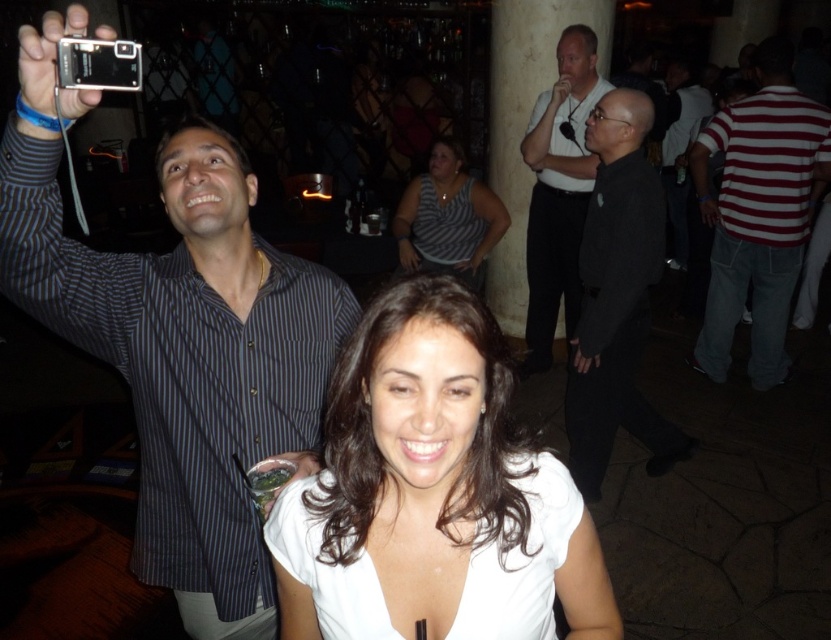
Is red striped shirt at right further to camera compared to white matte shirt at upper center?

Yes, it is.

Is red striped shirt at right taller than white matte shirt at upper center?

Yes, red striped shirt at right is taller than white matte shirt at upper center.

Is point (702, 205) in front of point (574, 204)?

No, it is behind (574, 204).

Find the location of a particular element. The width and height of the screenshot is (831, 640). red striped shirt at right is located at coordinates (758, 212).

Can you confirm if striped shirt at upper left is taller than striped fabric shirt at center?

Indeed, striped shirt at upper left has a greater height compared to striped fabric shirt at center.

Does striped shirt at upper left have a larger size compared to striped fabric shirt at center?

Yes.

Where is `striped shirt at upper left`? The image size is (831, 640). striped shirt at upper left is located at coordinates (179, 339).

Is point (303, 577) behind point (721, 125)?

No, it is in front of (721, 125).

Is white matte shirt at center positioned behind red striped shirt at right?

No, it is in front of red striped shirt at right.

Which is behind, point (578, 564) or point (824, 129)?

Positioned behind is point (824, 129).

The width and height of the screenshot is (831, 640). I want to click on white matte shirt at center, so click(x=431, y=492).